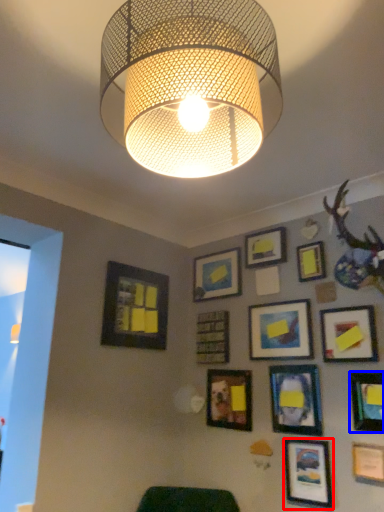
Question: Which point is closer to the camera, picture frame (highlighted by a red box) or picture frame (highlighted by a blue box)?

Choices:
 (A) picture frame
 (B) picture frame

Answer: (B)